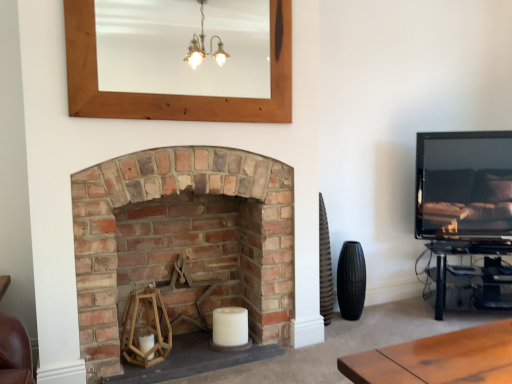
Question: In terms of height, does rustic brick fireplace at center look taller or shorter compared to matte black tv at right?

Choices:
 (A) short
 (B) tall

Answer: (B)

Question: Is rustic brick fireplace at center to the left or to the right of matte black tv at right in the image?

Choices:
 (A) left
 (B) right

Answer: (A)

Question: Based on their relative distances, which object is nearer to the matte black tv at right?

Choices:
 (A) wooden mirror at upper center
 (B) rustic brick fireplace at center

Answer: (A)

Question: Based on their relative distances, which object is nearer to the matte black tv at right?

Choices:
 (A) rustic brick fireplace at center
 (B) wooden mirror at upper center

Answer: (B)